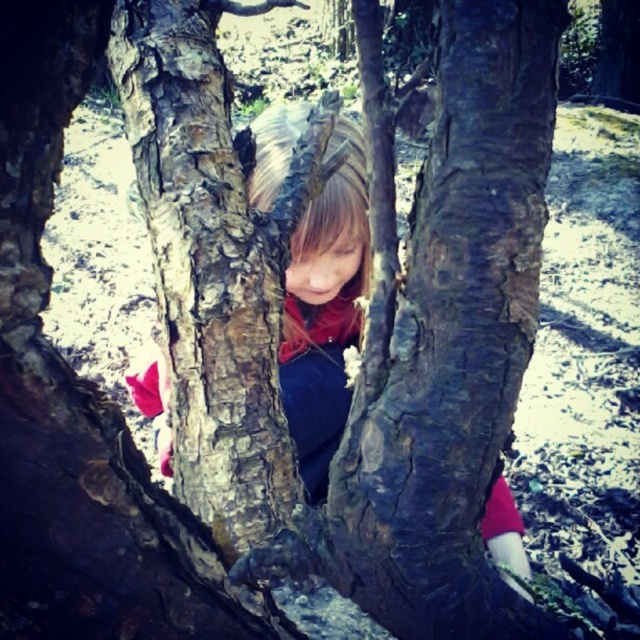
Question: Which point is farther from the camera taking this photo?

Choices:
 (A) (339, 141)
 (B) (237, 481)

Answer: (A)

Question: Does smooth bark tree trunk at center come in front of matte red shirt at center?

Choices:
 (A) no
 (B) yes

Answer: (B)

Question: Which object appears farthest from the camera in this image?

Choices:
 (A) smooth bark tree trunk at center
 (B) matte red shirt at center

Answer: (B)

Question: Does smooth bark tree trunk at center appear over matte red shirt at center?

Choices:
 (A) no
 (B) yes

Answer: (B)

Question: Can you confirm if smooth bark tree trunk at center is positioned to the left of matte red shirt at center?

Choices:
 (A) yes
 (B) no

Answer: (B)

Question: Which point is closer to the camera?

Choices:
 (A) (291, 433)
 (B) (212, 224)

Answer: (B)